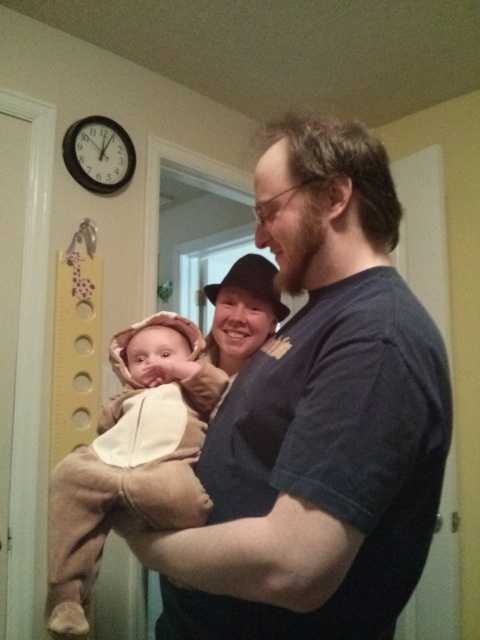
Which of these two, dark blue t-shirt at center or soft beige costume at center, stands shorter?

soft beige costume at center is shorter.

Identify the location of dark blue t-shirt at center. (317, 420).

Does dark blue t-shirt at center have a smaller size compared to black plastic clock at upper left?

Incorrect, dark blue t-shirt at center is not smaller in size than black plastic clock at upper left.

Who is taller, dark blue t-shirt at center or black plastic clock at upper left?

dark blue t-shirt at center

Is point (197, 545) positioned in front of point (105, 120)?

Yes, it is.

Find the location of `dark blue t-shirt at center`. dark blue t-shirt at center is located at coordinates (317, 420).

Based on the photo, does soft beige costume at center have a greater height compared to black plastic clock at upper left?

Correct, soft beige costume at center is much taller as black plastic clock at upper left.

From the picture: Who is lower down, soft beige costume at center or black plastic clock at upper left?

Positioned lower is soft beige costume at center.

Locate an element on the screen. soft beige costume at center is located at coordinates (131, 465).